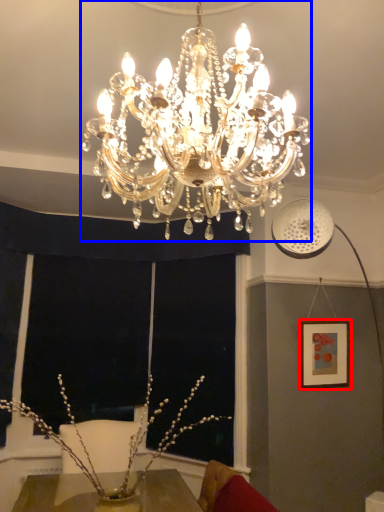
Question: Which point is closer to the camera, picture frame (highlighted by a red box) or lamp (highlighted by a blue box)?

Choices:
 (A) picture frame
 (B) lamp

Answer: (B)